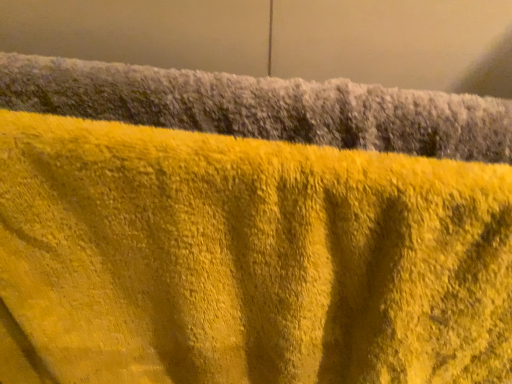
Question: Relative to yellow fuzzy towel at upper center, which ranks as the first towel in bottom-to-top order, is yellow fuzzy towel at upper center, which is counted as the 1th towel, starting from the top, in front or behind?

Choices:
 (A) front
 (B) behind

Answer: (B)

Question: From a real-world perspective, is yellow fuzzy towel at upper center, the 2th towel in the bottom-to-top sequence, physically located above or below yellow fuzzy towel at upper center, which ranks as the first towel in bottom-to-top order?

Choices:
 (A) below
 (B) above

Answer: (B)

Question: In terms of width, does yellow fuzzy towel at upper center, the 2th towel in the bottom-to-top sequence, look wider or thinner when compared to yellow fuzzy towel at upper center, which ranks as the first towel in bottom-to-top order?

Choices:
 (A) thin
 (B) wide

Answer: (A)

Question: Looking at the image, does yellow fuzzy towel at upper center, the second towel when ordered from top to bottom, seem bigger or smaller compared to yellow fuzzy towel at upper center, the 2th towel in the bottom-to-top sequence?

Choices:
 (A) big
 (B) small

Answer: (A)

Question: From a real-world perspective, is yellow fuzzy towel at upper center, the second towel when ordered from top to bottom, physically located above or below yellow fuzzy towel at upper center, the 2th towel in the bottom-to-top sequence?

Choices:
 (A) above
 (B) below

Answer: (B)

Question: Would you say yellow fuzzy towel at upper center, the second towel when ordered from top to bottom, is to the left or to the right of yellow fuzzy towel at upper center, the 2th towel in the bottom-to-top sequence, in the picture?

Choices:
 (A) left
 (B) right

Answer: (A)

Question: Which is correct: yellow fuzzy towel at upper center, which ranks as the first towel in bottom-to-top order, is inside yellow fuzzy towel at upper center, which is counted as the 1th towel, starting from the top, or outside of it?

Choices:
 (A) inside
 (B) outside

Answer: (B)